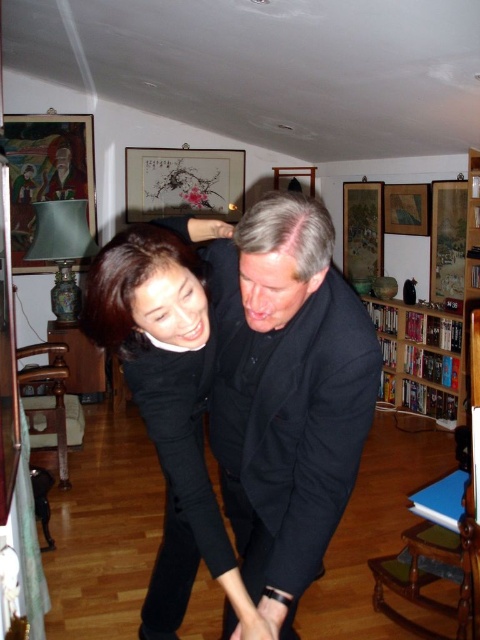
Question: Estimate the real-world distances between objects in this image. Which object is closer to the black matte dress at center?

Choices:
 (A) wooden bookshelf at right
 (B) black matte suit at center

Answer: (B)

Question: Is black matte suit at center to the left of wooden bookshelf at right from the viewer's perspective?

Choices:
 (A) no
 (B) yes

Answer: (B)

Question: Is the position of black matte suit at center more distant than that of black matte dress at center?

Choices:
 (A) yes
 (B) no

Answer: (B)

Question: Which of the following is the closest to the observer?

Choices:
 (A) (155, 244)
 (B) (290, 426)

Answer: (A)

Question: Is black matte dress at center thinner than wooden bookshelf at right?

Choices:
 (A) yes
 (B) no

Answer: (A)

Question: Which point is closer to the camera?

Choices:
 (A) (147, 227)
 (B) (443, 410)

Answer: (A)